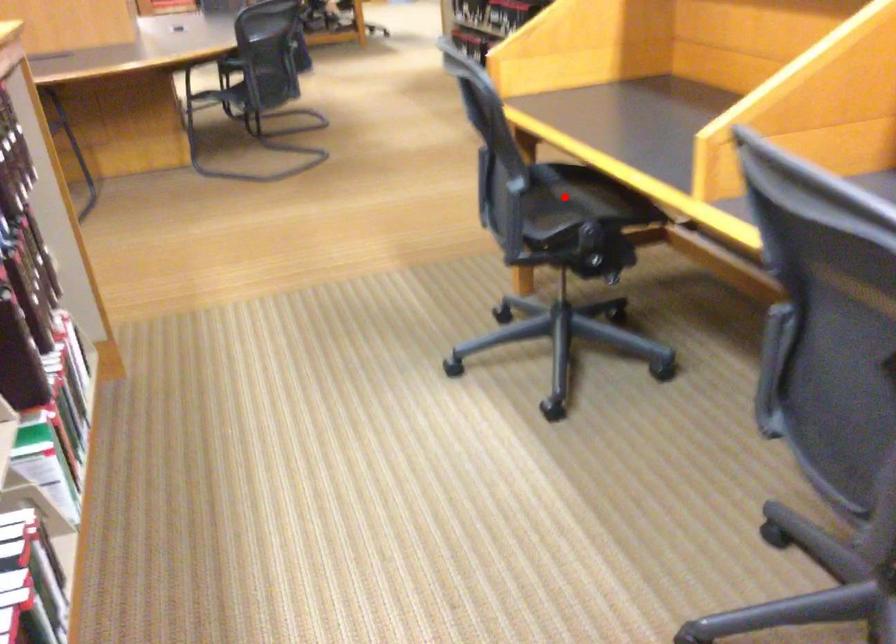
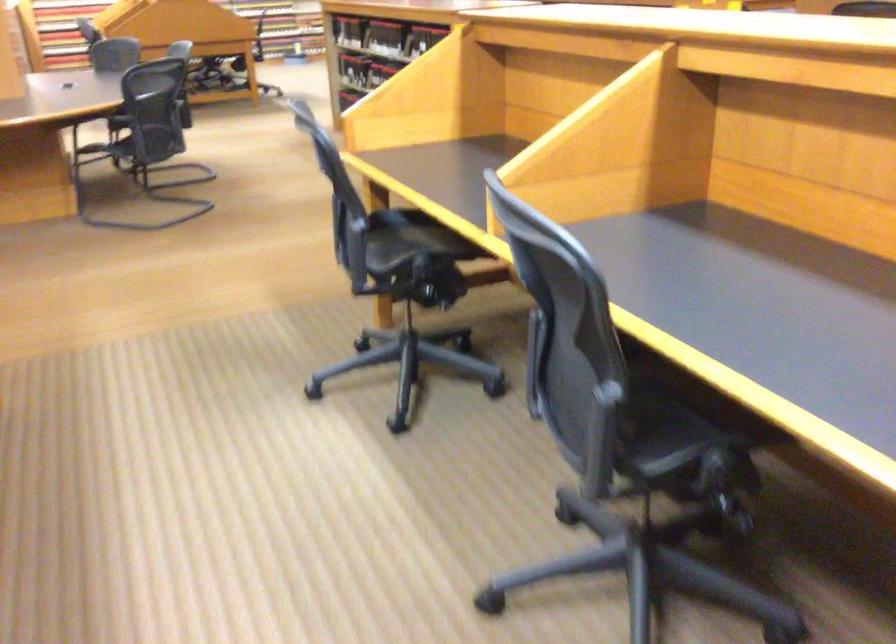
In the second image, find the point that corresponds to the highlighted location in the first image.

(409, 240)